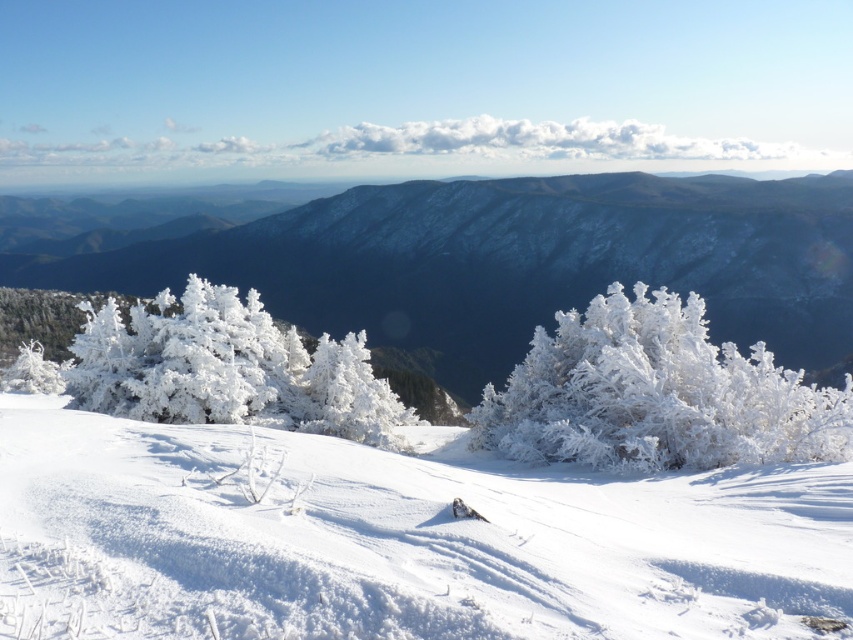
How much distance is there between frosted white trees at center and frosted white trees at left?

frosted white trees at center and frosted white trees at left are 618.03 feet apart.

Is frosted white trees at center shorter than frosted white trees at left?

No, frosted white trees at center is not shorter than frosted white trees at left.

Between point (607, 216) and point (252, 403), which one is positioned behind?

Point (607, 216)

The height and width of the screenshot is (640, 853). In order to click on frosted white trees at center in this screenshot , I will do (x=515, y=260).

Does frosted white trees at center appear on the right side of frosted white bush at center?

Indeed, frosted white trees at center is positioned on the right side of frosted white bush at center.

Can you confirm if frosted white trees at center is positioned to the left of frosted white bush at center?

In fact, frosted white trees at center is to the right of frosted white bush at center.

Which is behind, point (631, 220) or point (641, 369)?

Positioned behind is point (631, 220).

The height and width of the screenshot is (640, 853). I want to click on frosted white trees at center, so click(515, 260).

Can you confirm if white frosty snow at center is wider than frosted white trees at center?

No, white frosty snow at center is not wider than frosted white trees at center.

Consider the image. Is white frosty snow at center smaller than frosted white trees at center?

Correct, white frosty snow at center occupies less space than frosted white trees at center.

Identify the location of white frosty snow at center. The image size is (853, 640). (393, 540).